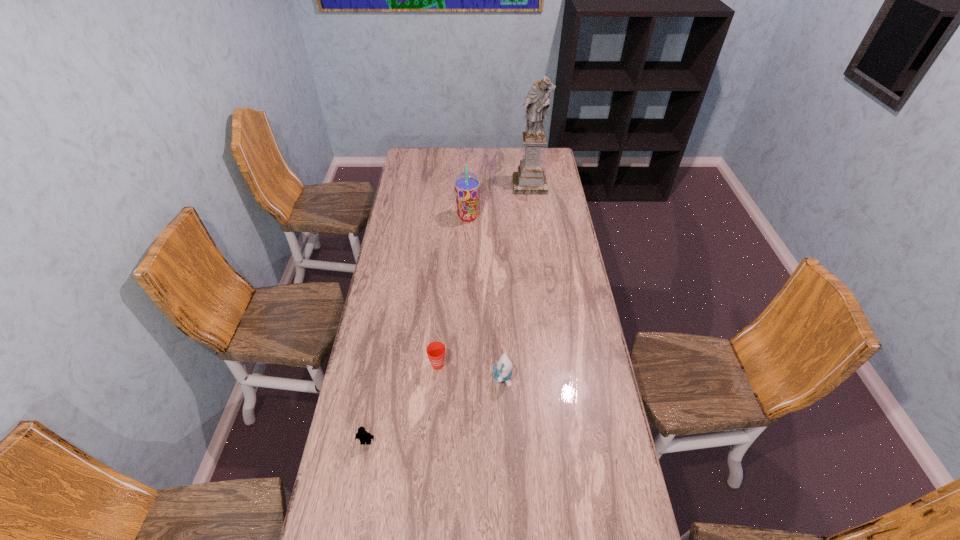
The width and height of the screenshot is (960, 540). Identify the location of vacant area between the cup and the rightmost object. (484, 275).

Where is `free spot between the smoothie and the farthest object`? This screenshot has height=540, width=960. free spot between the smoothie and the farthest object is located at coordinates (498, 201).

In order to click on empty space between the second object from right to left and the nearest object in this screenshot , I will do `click(434, 409)`.

This screenshot has height=540, width=960. Identify the location of free spot between the rightmost object and the smoothie. (498, 201).

Locate an element on the screen. The height and width of the screenshot is (540, 960). vacant region between the second tallest object and the cup is located at coordinates (453, 291).

Locate an element on the screen. Image resolution: width=960 pixels, height=540 pixels. vacant region between the kitten and the farthest object is located at coordinates (516, 281).

Locate an element on the screen. free space between the cup and the fourth shortest object is located at coordinates (453, 291).

The image size is (960, 540). Identify the location of free point between the second object from right to left and the tallest object. (516, 281).

At what (x,y) coordinates should I click in order to perform the action: click on free space between the cup and the smoothie. Please return your answer as a coordinate pair (x, y). Looking at the image, I should click on (453, 291).

Select which object is the fourth closest to the farthest object. Please provide its 2D coordinates. Your answer should be formatted as a tuple, i.e. [(x, y)], where the tuple contains the x and y coordinates of a point satisfying the conditions above.

[(362, 435)]